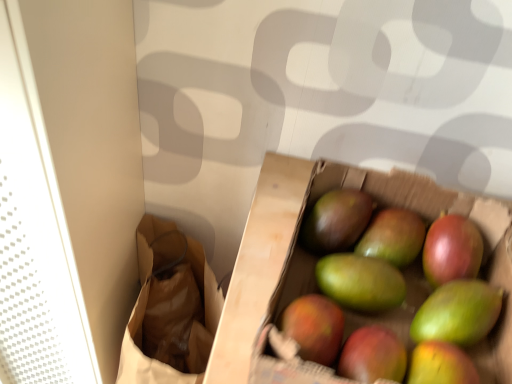
The height and width of the screenshot is (384, 512). What do you see at coordinates (390, 276) in the screenshot? I see `green matte mango at center, the 1th grapefruit viewed from the left` at bounding box center [390, 276].

Where is `shiny red grapefruit at center right, acting as the second grapefruit starting from the left`? The width and height of the screenshot is (512, 384). shiny red grapefruit at center right, acting as the second grapefruit starting from the left is located at coordinates (451, 250).

At what (x,y) coordinates should I click in order to perform the action: click on brown paper bag at left. Please return your answer as a coordinate pair (x, y). This screenshot has height=384, width=512. Looking at the image, I should click on (170, 309).

The width and height of the screenshot is (512, 384). In order to click on green matte mango at center in this screenshot , I will do `click(393, 236)`.

Where is `green matte mango at center, the 1th grapefruit viewed from the left`? green matte mango at center, the 1th grapefruit viewed from the left is located at coordinates (390, 276).

Does point (354, 204) appear closer or farther from the camera than point (390, 233)?

Point (354, 204) is farther from the camera than point (390, 233).

Is green matte mango at center at the back of green matte mango at center?

No.

From the image's perspective, is green matte mango at center over green matte mango at center?

Yes.

Can you confirm if green matte mango at center is taller than green matte mango at center?

Indeed, green matte mango at center has a greater height compared to green matte mango at center.

Where is `apple below the green matte mango at center (from the image's perspective)`? The image size is (512, 384). apple below the green matte mango at center (from the image's perspective) is located at coordinates (393, 236).

Is green matte mango at center completely or partially inside green matte mango at center?

No, green matte mango at center is not a part of green matte mango at center.

Is green matte mango at center shorter than green matte mango at center?

Yes.

Considering the positions of points (406, 261) and (347, 234), is point (406, 261) farther from camera compared to point (347, 234)?

Yes, point (406, 261) is behind point (347, 234).

Is green matte mango at center, the 1th grapefruit viewed from the left, in front of green matte mango at center?

Yes, the depth of green matte mango at center, the 1th grapefruit viewed from the left, is less than that of green matte mango at center.

Is green matte mango at center, the 1th grapefruit viewed from the left, to the left of green matte mango at center from the viewer's perspective?

Yes.

Is green matte mango at center, the second grapefruit when ordered from right to left, facing towards green matte mango at center?

No, green matte mango at center, the second grapefruit when ordered from right to left, does not turn towards green matte mango at center.

Which object is wider, green matte mango at center, the second grapefruit when ordered from right to left, or green matte mango at center?

With larger width is green matte mango at center, the second grapefruit when ordered from right to left.

Considering the positions of point (352, 238) and point (430, 246), is point (352, 238) closer or farther from the camera than point (430, 246)?

Clearly, point (352, 238) is more distant from the camera than point (430, 246).

Does green matte mango at center turn towards shiny red grapefruit at center right, which is counted as the first grapefruit, starting from the right?

No, green matte mango at center is not facing towards shiny red grapefruit at center right, which is counted as the first grapefruit, starting from the right.

I want to click on grapefruit that is the 1st one above the green matte mango at center (from a real-world perspective), so [451, 250].

Are green matte mango at center and shiny red grapefruit at center right, which is counted as the first grapefruit, starting from the right, making contact?

green matte mango at center and shiny red grapefruit at center right, which is counted as the first grapefruit, starting from the right, are clearly separated.

Which is in front, point (310, 229) or point (146, 368)?

The point (310, 229) is in front.

Where is `shopping bag below the green matte mango at center (from a real-world perspective)`? shopping bag below the green matte mango at center (from a real-world perspective) is located at coordinates (170, 309).

Relative to green matte mango at center, the second grapefruit when ordered from right to left, is brown paper bag at left in front or behind?

brown paper bag at left is positioned farther from the viewer than green matte mango at center, the second grapefruit when ordered from right to left.

From a real-world perspective, is brown paper bag at left located higher than green matte mango at center, the 1th grapefruit viewed from the left?

No, from a real-world perspective, brown paper bag at left is not above green matte mango at center, the 1th grapefruit viewed from the left.

Considering the relative sizes of brown paper bag at left and green matte mango at center, the 1th grapefruit viewed from the left, in the image provided, is brown paper bag at left bigger than green matte mango at center, the 1th grapefruit viewed from the left,?

Yes, brown paper bag at left is bigger than green matte mango at center, the 1th grapefruit viewed from the left.

Is brown paper bag at left situated inside green matte mango at center, the 1th grapefruit viewed from the left, or outside?

brown paper bag at left lies outside green matte mango at center, the 1th grapefruit viewed from the left.

This screenshot has width=512, height=384. Identify the location of shopping bag behind the green matte mango at center. (170, 309).

Are green matte mango at center and brown paper bag at left making contact?

They are not placed beside each other.

Is green matte mango at center inside or outside of brown paper bag at left?

green matte mango at center cannot be found inside brown paper bag at left.

In the image, is green matte mango at center positioned in front of or behind brown paper bag at left?

green matte mango at center is in front of brown paper bag at left.

Where is `mango on the left of green matte mango at center`? The height and width of the screenshot is (384, 512). mango on the left of green matte mango at center is located at coordinates (336, 220).

In order to click on apple behind the green matte mango at center in this screenshot , I will do `click(393, 236)`.

When comparing their distances from green matte mango at center, does brown paper bag at left or shiny red grapefruit at center right, acting as the second grapefruit starting from the left, seem further?

brown paper bag at left lies further to green matte mango at center than the other object.

Looking at the image, which one is located closer to green matte mango at center, shiny red grapefruit at center right, acting as the second grapefruit starting from the left, or brown paper bag at left?

shiny red grapefruit at center right, acting as the second grapefruit starting from the left, lies closer to green matte mango at center than the other object.

Which object lies nearer to the anchor point green matte mango at center, brown paper bag at left or green matte mango at center, the second grapefruit when ordered from right to left?

green matte mango at center, the second grapefruit when ordered from right to left, lies closer to green matte mango at center than the other object.

Which object lies further to the anchor point green matte mango at center, green matte mango at center or green matte mango at center, the 1th grapefruit viewed from the left?

Based on the image, green matte mango at center, the 1th grapefruit viewed from the left, appears to be further to green matte mango at center.

Looking at the image, which one is located closer to brown paper bag at left, green matte mango at center or green matte mango at center, the 1th grapefruit viewed from the left?

The object closer to brown paper bag at left is green matte mango at center, the 1th grapefruit viewed from the left.

From the image, which object appears to be nearer to shiny red grapefruit at center right, which is counted as the first grapefruit, starting from the right, green matte mango at center, the second grapefruit when ordered from right to left, or green matte mango at center?

The object closer to shiny red grapefruit at center right, which is counted as the first grapefruit, starting from the right, is green matte mango at center.

From the image, which object appears to be farther from green matte mango at center, the second grapefruit when ordered from right to left, green matte mango at center or shiny red grapefruit at center right, which is counted as the first grapefruit, starting from the right?

The object further to green matte mango at center, the second grapefruit when ordered from right to left, is shiny red grapefruit at center right, which is counted as the first grapefruit, starting from the right.

Considering their positions, is green matte mango at center, the second grapefruit when ordered from right to left, positioned closer to green matte mango at center than green matte mango at center?

Among the two, green matte mango at center is located nearer to green matte mango at center.

Image resolution: width=512 pixels, height=384 pixels. Find the location of `grapefruit between green matte mango at center, the second grapefruit when ordered from right to left, and green matte mango at center, along the z-axis`. grapefruit between green matte mango at center, the second grapefruit when ordered from right to left, and green matte mango at center, along the z-axis is located at coordinates (451, 250).

The width and height of the screenshot is (512, 384). I want to click on apple between green matte mango at center and shiny red grapefruit at center right, acting as the second grapefruit starting from the left, from left to right, so click(x=393, y=236).

At what (x,y) coordinates should I click in order to perform the action: click on apple between brown paper bag at left and shiny red grapefruit at center right, acting as the second grapefruit starting from the left, in the horizontal direction. Please return your answer as a coordinate pair (x, y). Looking at the image, I should click on (393, 236).

I want to click on mango between green matte mango at center, the second grapefruit when ordered from right to left, and green matte mango at center from front to back, so click(x=336, y=220).